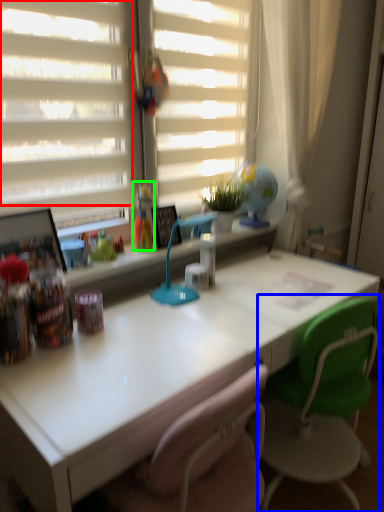
Question: Considering the real-world distances, which object is closest to shutter (highlighted by a red box)? chair (highlighted by a blue box) or toy (highlighted by a green box).

Choices:
 (A) chair
 (B) toy

Answer: (B)